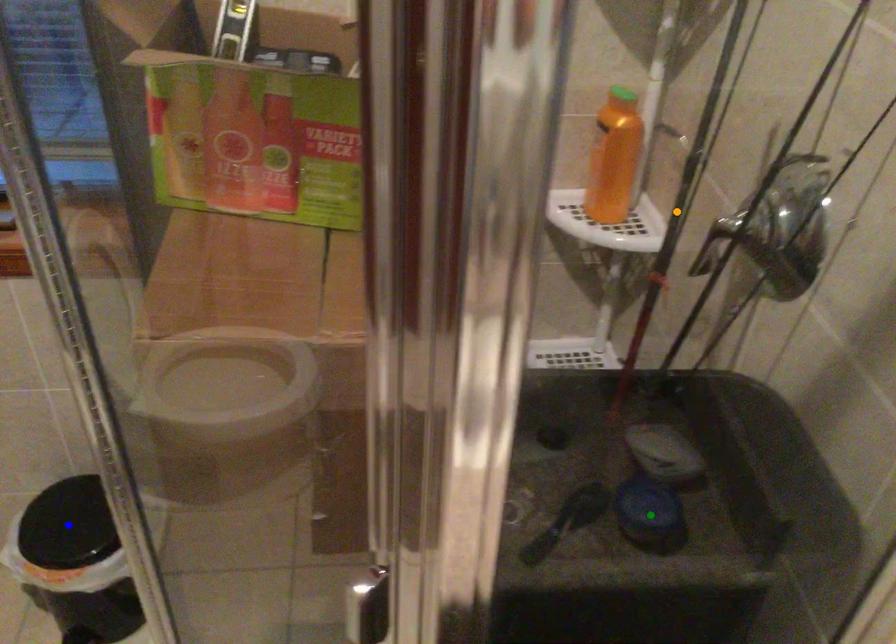
Order these from farthest to nearest:
orange point
blue point
green point

blue point, green point, orange point